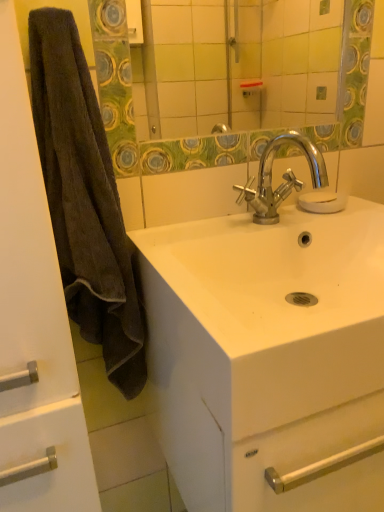
Question: Considering the relative sizes of brown fuzzy towel at left and transparent glass soap at center in the image provided, is brown fuzzy towel at left bigger than transparent glass soap at center?

Choices:
 (A) no
 (B) yes

Answer: (B)

Question: Considering the relative sizes of brown fuzzy towel at left and transparent glass soap at center in the image provided, is brown fuzzy towel at left smaller than transparent glass soap at center?

Choices:
 (A) yes
 (B) no

Answer: (B)

Question: Is brown fuzzy towel at left further to the viewer compared to transparent glass soap at center?

Choices:
 (A) no
 (B) yes

Answer: (A)

Question: Is brown fuzzy towel at left at the left side of transparent glass soap at center?

Choices:
 (A) no
 (B) yes

Answer: (B)

Question: From a real-world perspective, is brown fuzzy towel at left beneath transparent glass soap at center?

Choices:
 (A) yes
 (B) no

Answer: (B)

Question: Does point (324, 94) appear closer or farther from the camera than point (254, 218)?

Choices:
 (A) closer
 (B) farther

Answer: (B)

Question: Is green textured mirror at upper center inside or outside of chrome metallic faucet at center?

Choices:
 (A) outside
 (B) inside

Answer: (A)

Question: Based on their positions, is green textured mirror at upper center located to the left or right of chrome metallic faucet at center?

Choices:
 (A) right
 (B) left

Answer: (B)

Question: Considering the positions of green textured mirror at upper center and chrome metallic faucet at center in the image, is green textured mirror at upper center wider or thinner than chrome metallic faucet at center?

Choices:
 (A) wide
 (B) thin

Answer: (B)

Question: In terms of size, does brown fuzzy towel at left appear bigger or smaller than chrome metallic faucet at center?

Choices:
 (A) big
 (B) small

Answer: (A)

Question: Would you say brown fuzzy towel at left is to the left or to the right of chrome metallic faucet at center in the picture?

Choices:
 (A) right
 (B) left

Answer: (B)

Question: Relative to chrome metallic faucet at center, is brown fuzzy towel at left in front or behind?

Choices:
 (A) front
 (B) behind

Answer: (A)

Question: From a real-world perspective, is brown fuzzy towel at left physically located above or below chrome metallic faucet at center?

Choices:
 (A) below
 (B) above

Answer: (A)

Question: Looking at the image, does chrome metallic faucet at center seem bigger or smaller compared to green textured mirror at upper center?

Choices:
 (A) big
 (B) small

Answer: (B)

Question: Relative to green textured mirror at upper center, is chrome metallic faucet at center in front or behind?

Choices:
 (A) front
 (B) behind

Answer: (A)